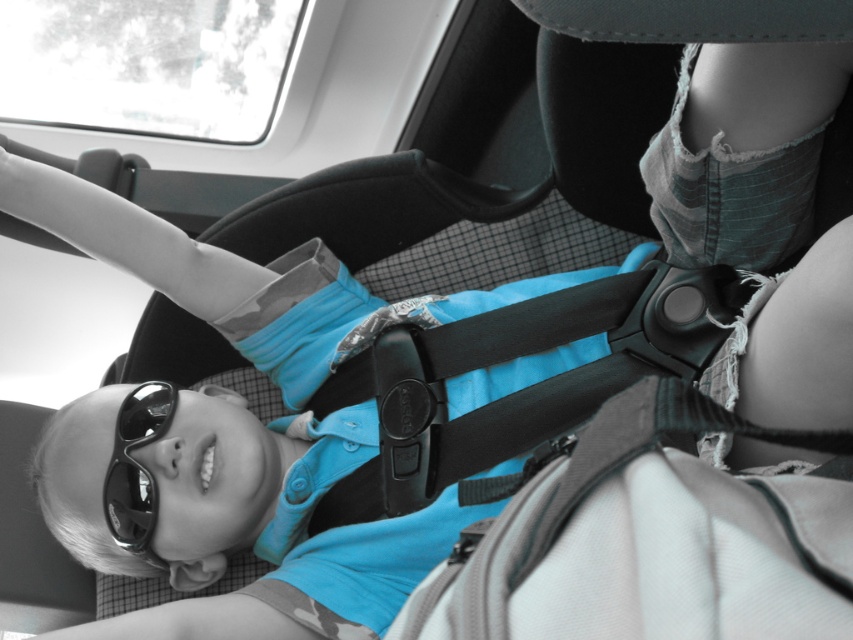
You are a safety inspector checking the car seat setup. You notice the black fabric seatbelt at center and the black reflective sunglasses at lower left. Which object is bigger in size?

The black fabric seatbelt at center is larger in size than the black reflective sunglasses at lower left.

You are a safety inspector checking the car seat setup. The black fabric seatbelt at center and the black reflective sunglasses at lower left are in the image. According to safety guidelines, seatbelts must be positioned above any loose items. Is the current setup compliant with this rule?

The black fabric seatbelt at center is above the black reflective sunglasses at lower left, so the setup complies with the safety guideline requiring seatbelts to be positioned above loose items.

You are a safety inspector checking the distance between the black fabric seatbelt at center and the camera in a car. According to safety regulations, the minimum required distance is 90 centimeters. Is the current distance compliant?

The black fabric seatbelt at center and camera are 96.26 centimeters apart from each other, which exceeds the minimum required distance of 90 centimeters. Therefore, the current distance is compliant with safety regulations.